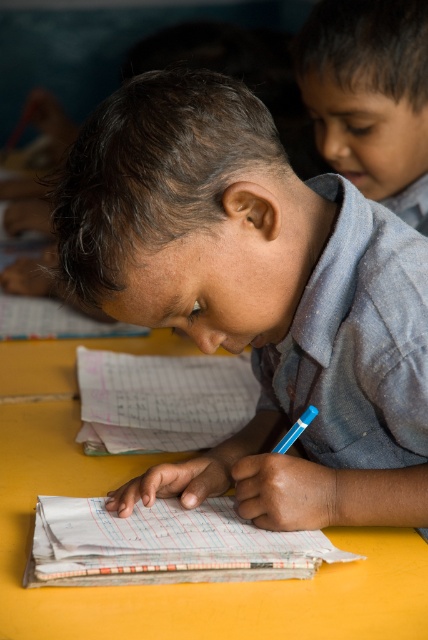
Does smooth blue shirt at upper right have a larger size compared to blue plastic pencil at center?

Indeed, smooth blue shirt at upper right has a larger size compared to blue plastic pencil at center.

Is smooth blue shirt at upper right above blue plastic pencil at center?

Correct, smooth blue shirt at upper right is located above blue plastic pencil at center.

Who is more forward, (327, 60) or (291, 426)?

Point (291, 426)

This screenshot has width=428, height=640. I want to click on smooth blue shirt at upper right, so click(369, 97).

Can you confirm if white lined paper at center is positioned to the right of blue plastic pencil at center?

In fact, white lined paper at center is to the left of blue plastic pencil at center.

Can you confirm if white lined paper at center is thinner than blue plastic pencil at center?

No.

Who is more distant from viewer, (231, 413) or (281, 451)?

The point (231, 413) is behind.

Locate an element on the screen. The image size is (428, 640). white lined paper at center is located at coordinates (163, 400).

Between point (374, 227) and point (157, 435), which one is positioned behind?

Positioned behind is point (157, 435).

Between matte blue shirt at center and white lined paper at center, which one is positioned higher?

matte blue shirt at center

Looking at this image, who is more forward, (x=92, y=176) or (x=115, y=362)?

Point (x=92, y=176) is in front.

In order to click on matte blue shirt at center in this screenshot , I will do `click(256, 298)`.